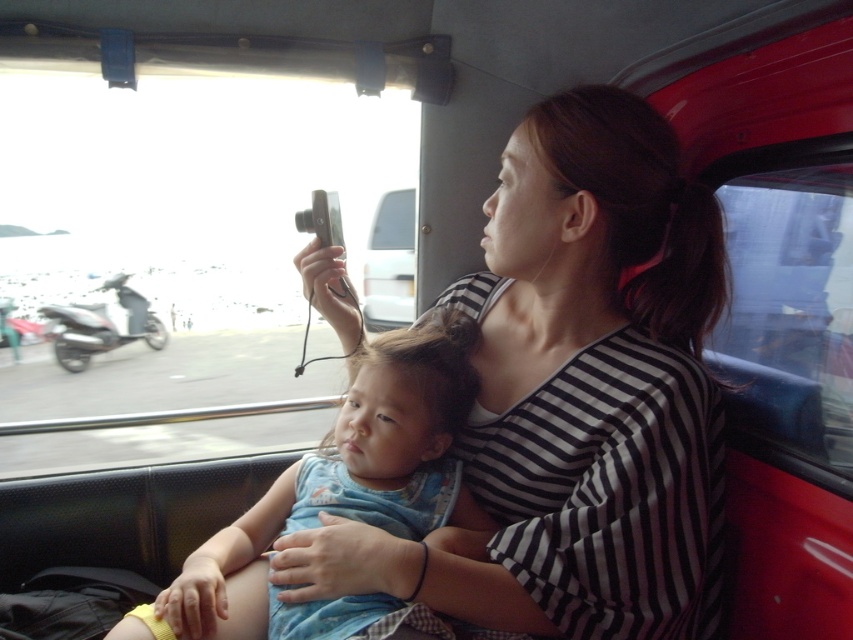
What object is located at the coordinates point (x=576, y=396)?

The point (x=576, y=396) corresponds to the striped fabric shirt at center.

In the scene shown: You are sitting in the vehicle and want to know which of the two points, point (x=496, y=596) or point (x=358, y=499), is closer to you. Can you determine this based on the scene?

Point (x=496, y=596) is closer to the viewer than point (x=358, y=499).